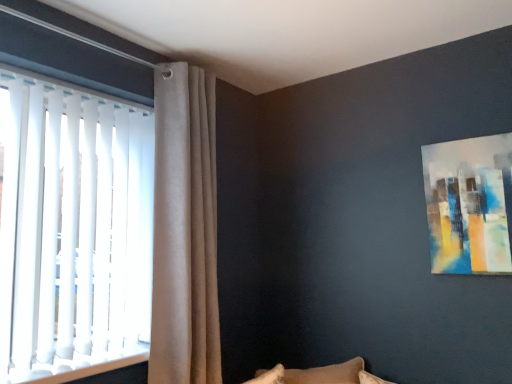
Question: Is white vertical blinds at left touching abstract painting at upper right?

Choices:
 (A) yes
 (B) no

Answer: (B)

Question: Is white vertical blinds at left at the right side of abstract painting at upper right?

Choices:
 (A) yes
 (B) no

Answer: (B)

Question: From the image's perspective, is white vertical blinds at left on top of abstract painting at upper right?

Choices:
 (A) no
 (B) yes

Answer: (A)

Question: Is white vertical blinds at left facing away from abstract painting at upper right?

Choices:
 (A) yes
 (B) no

Answer: (B)

Question: From a real-world perspective, is white vertical blinds at left below abstract painting at upper right?

Choices:
 (A) no
 (B) yes

Answer: (B)

Question: Does white vertical blinds at left have a greater width compared to abstract painting at upper right?

Choices:
 (A) no
 (B) yes

Answer: (B)

Question: Does beige velvet curtain at upper left have a lesser width compared to abstract painting at upper right?

Choices:
 (A) no
 (B) yes

Answer: (A)

Question: Considering the relative positions of beige velvet curtain at upper left and abstract painting at upper right in the image provided, is beige velvet curtain at upper left to the left of abstract painting at upper right from the viewer's perspective?

Choices:
 (A) yes
 (B) no

Answer: (A)

Question: From a real-world perspective, is beige velvet curtain at upper left physically above abstract painting at upper right?

Choices:
 (A) no
 (B) yes

Answer: (A)

Question: Is beige velvet curtain at upper left smaller than abstract painting at upper right?

Choices:
 (A) yes
 (B) no

Answer: (B)

Question: Is beige velvet curtain at upper left further to the viewer compared to abstract painting at upper right?

Choices:
 (A) yes
 (B) no

Answer: (A)

Question: Is the position of beige velvet curtain at upper left less distant than that of abstract painting at upper right?

Choices:
 (A) yes
 (B) no

Answer: (B)

Question: Is abstract painting at upper right next to beige velvet curtain at upper left and touching it?

Choices:
 (A) no
 (B) yes

Answer: (A)